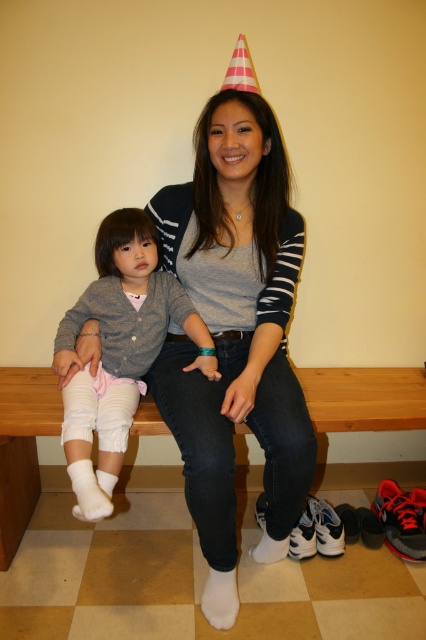
You are designing a display for a childrens clothing store and need to arrange two items from the image. The matte gray sweater at center and the white fluffy socks at left must be placed on a shelf. The shelf has limited vertical space. Which item should be placed lower on the shelf to ensure both items are visible?

The white fluffy socks at left should be placed lower on the shelf because the matte gray sweater at center is taller and needs more vertical space to be fully visible.

You are trying to identify clothing items in the image. Which clothing item is positioned to the right of the other between the matte gray sweater at center and the white fluffy socks at left?

The matte gray sweater at center is to the right of the white fluffy socks at left.